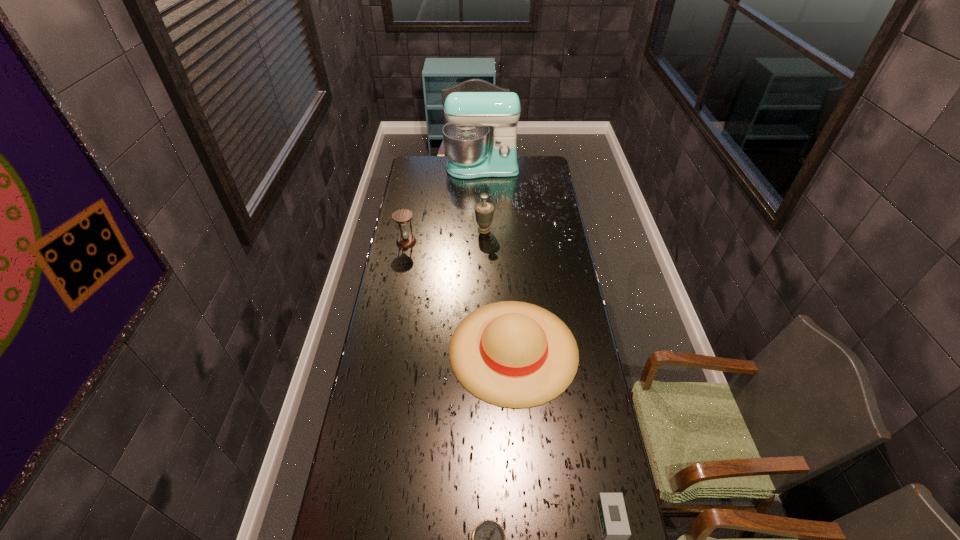
Image resolution: width=960 pixels, height=540 pixels. I want to click on the farthest object, so click(466, 136).

Where is `mixer`? mixer is located at coordinates (466, 136).

Identify the location of urn. The width and height of the screenshot is (960, 540). (484, 211).

You are a GUI agent. You are given a task and a screenshot of the screen. Output one action in this format:
    pyautogui.click(x=<x>, y=<y>)
    Task: Click on the leftmost object
    Image resolution: width=960 pixels, height=540 pixels.
    Given the screenshot: What is the action you would take?
    pyautogui.click(x=403, y=216)

This screenshot has height=540, width=960. I want to click on sombrero, so click(512, 354).

At what (x,y) coordinates should I click in order to perform the action: click on free spot located 0.050m at the base of the mixer. Please return your answer as a coordinate pair (x, y). This screenshot has height=540, width=960. Looking at the image, I should click on (482, 186).

Locate an element on the screen. The width and height of the screenshot is (960, 540). vacant space located 0.380m on the left of the urn is located at coordinates (396, 230).

Where is `vacant space situated 0.140m on the right of the hourglass`? vacant space situated 0.140m on the right of the hourglass is located at coordinates (446, 242).

The height and width of the screenshot is (540, 960). In order to click on free space located on the front of the sombrero in this screenshot , I will do `click(520, 454)`.

At what (x,y) coordinates should I click in order to perform the action: click on object that is positioned at the far edge. Please return your answer as a coordinate pair (x, y). This screenshot has width=960, height=540. Looking at the image, I should click on (466, 136).